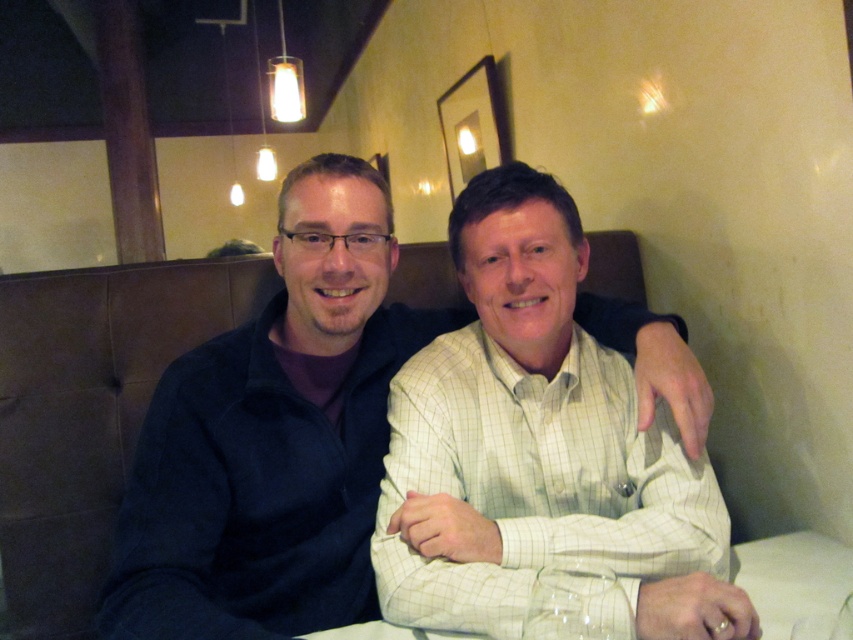
Which is above, clear glass table at center or clear glass wine glass at lower center?

clear glass wine glass at lower center

Between clear glass table at center and clear glass wine glass at lower center, which one appears on the right side from the viewer's perspective?

From the viewer's perspective, clear glass table at center appears more on the right side.

What do you see at coordinates (793, 580) in the screenshot?
I see `clear glass table at center` at bounding box center [793, 580].

Locate an element on the screen. The image size is (853, 640). clear glass table at center is located at coordinates (793, 580).

Between point (578, 236) and point (850, 548), which one is positioned in front?

Point (578, 236)

Does point (608, 392) lie in front of point (434, 634)?

No, (608, 392) is behind (434, 634).

In order to click on light green checkered shirt at center in this screenshot , I will do `click(538, 448)`.

This screenshot has width=853, height=640. I want to click on light green checkered shirt at center, so click(x=538, y=448).

Measure the distance between light green checkered shirt at center and camera.

They are 33.30 inches apart.

Can you confirm if light green checkered shirt at center is positioned below clear glass wine glass at lower center?

No, light green checkered shirt at center is not below clear glass wine glass at lower center.

Is point (698, 592) more distant than point (593, 564)?

No.

You are a GUI agent. You are given a task and a screenshot of the screen. Output one action in this format:
    pyautogui.click(x=<x>, y=<y>)
    Task: Click on the light green checkered shirt at center
    The height and width of the screenshot is (640, 853).
    Given the screenshot: What is the action you would take?
    pyautogui.click(x=538, y=448)